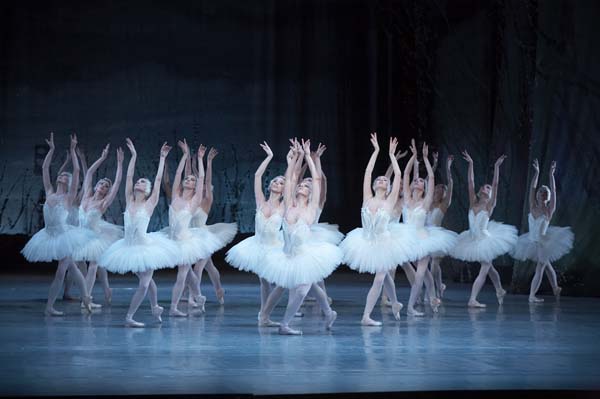
Where is `stage curtain`? The image size is (600, 399). stage curtain is located at coordinates (26, 162), (578, 206).